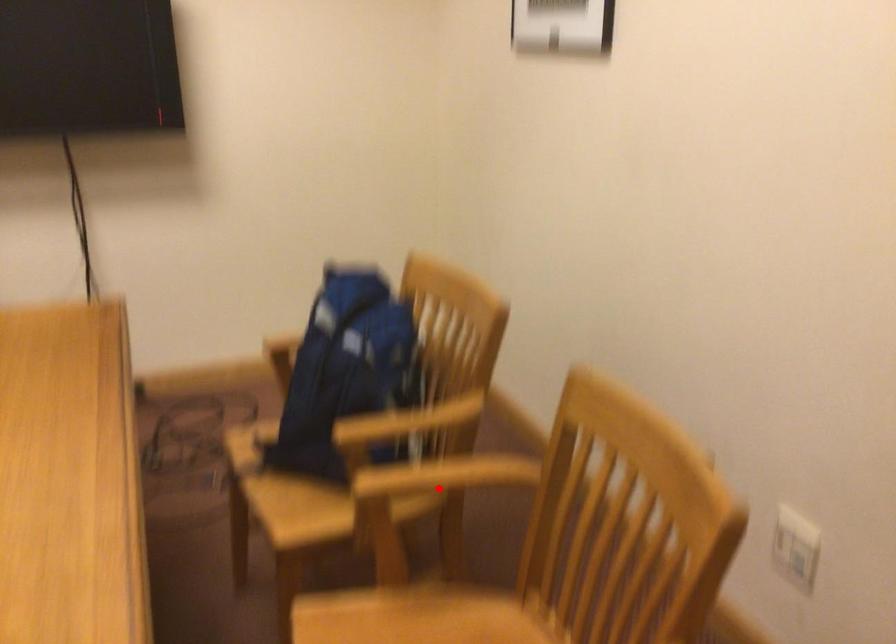
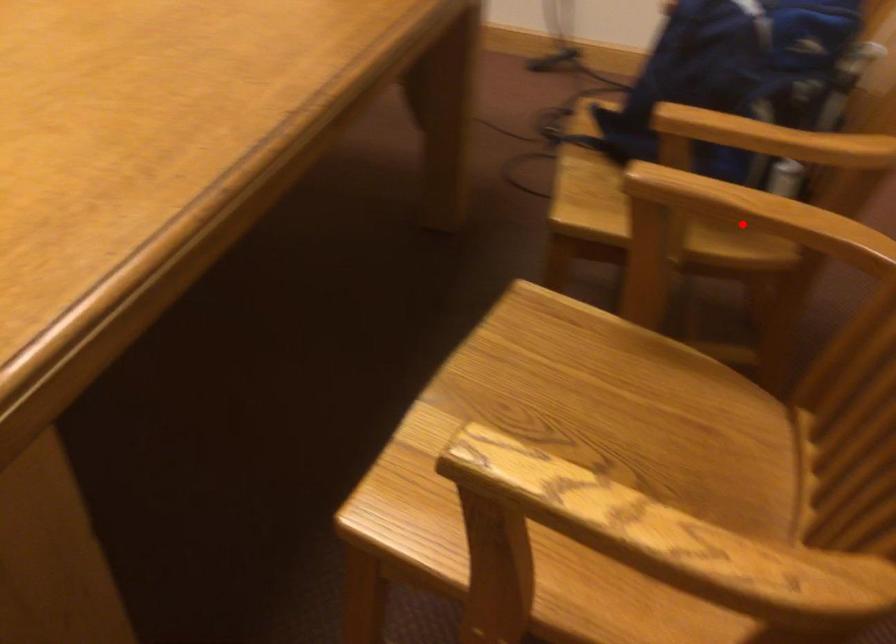
I am providing you with two images of the same scene from different viewpoints. A red point is marked on the first image and another point is marked on the second image. Does the point marked in image1 correspond to the same location as the one in image2?

Yes